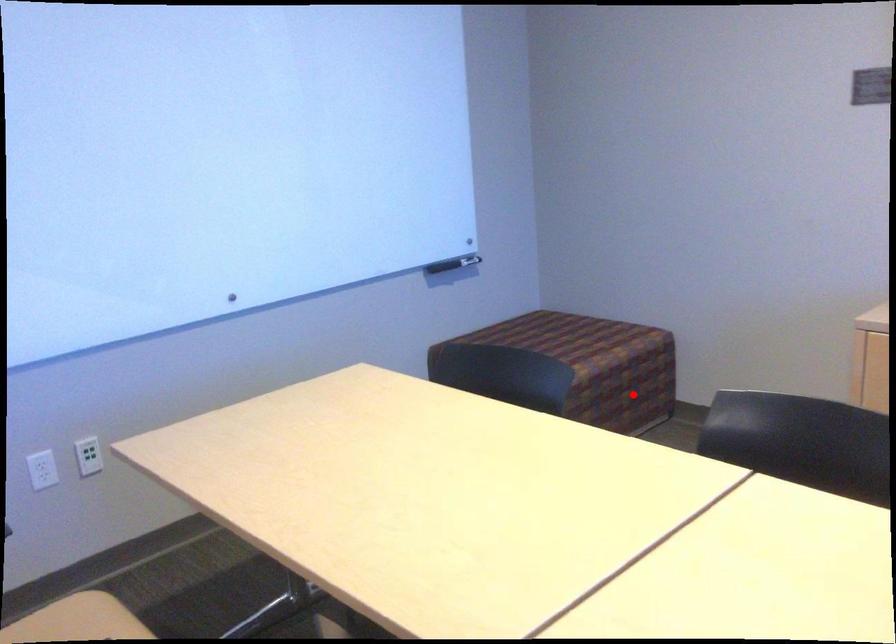
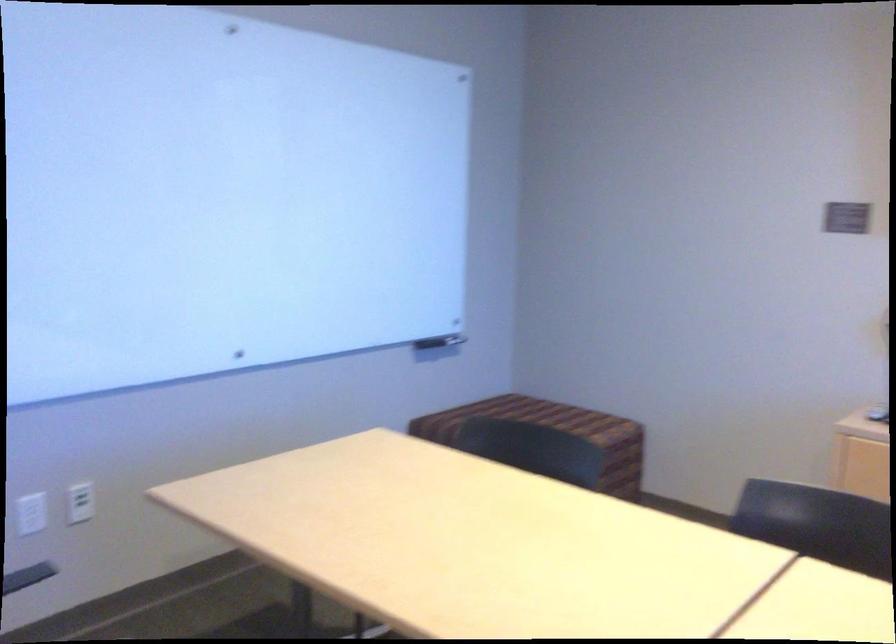
Locate, in the second image, the point that corresponds to the highlighted location in the first image.

(607, 482)